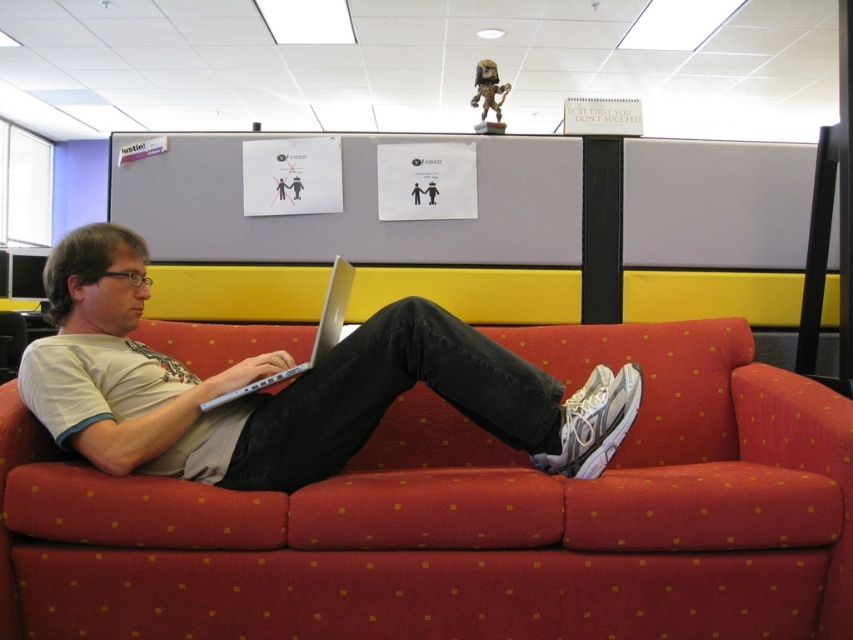
From the picture: You are standing in the office and need to place a new plant between the red fabric couch at center and the silver metallic laptop at center. Which object should the plant be closer to based on their current positions?

The red fabric couch at center is closer to the viewer than the silver metallic laptop at center, so the plant should be placed closer to the silver metallic laptop at center to maintain equal distance from both objects.

You are an interior designer assessing the office layout. You notice the white matte shirt at center and the silver metallic laptop at center. Based on their sizes, which object would require more floor space if placed on a small table?

The white matte shirt at center is bigger than the silver metallic laptop at center, so it would require more floor space on a small table.